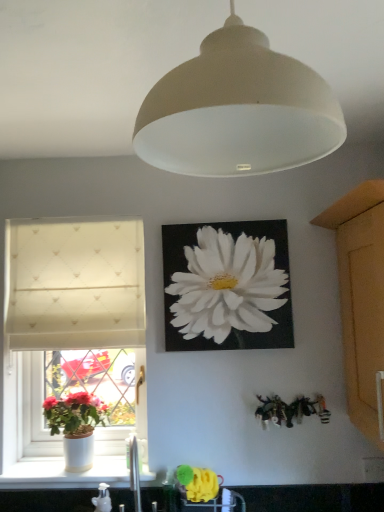
Question: From their relative heights in the image, would you say white fabric window at left is taller or shorter than white matte canvas at upper center?

Choices:
 (A) short
 (B) tall

Answer: (B)

Question: In terms of width, does white fabric window at left look wider or thinner when compared to white matte canvas at upper center?

Choices:
 (A) wide
 (B) thin

Answer: (A)

Question: Estimate the real-world distances between objects in this image. Which object is farther from the white matte lampshade at center?

Choices:
 (A) wooden cabinet at right
 (B) white fabric window at left
 (C) white glossy sink at lower center
 (D) white ceramic vase at lower left
 (E) matte white pot at window

Answer: (D)

Question: Estimate the real-world distances between objects in this image. Which object is closer to the wooden cabinet at right?

Choices:
 (A) white glossy sink at lower center
 (B) matte white pot at window
 (C) white textured curtain at left
 (D) white fabric window at left
 (E) white matte lampshade at center

Answer: (E)